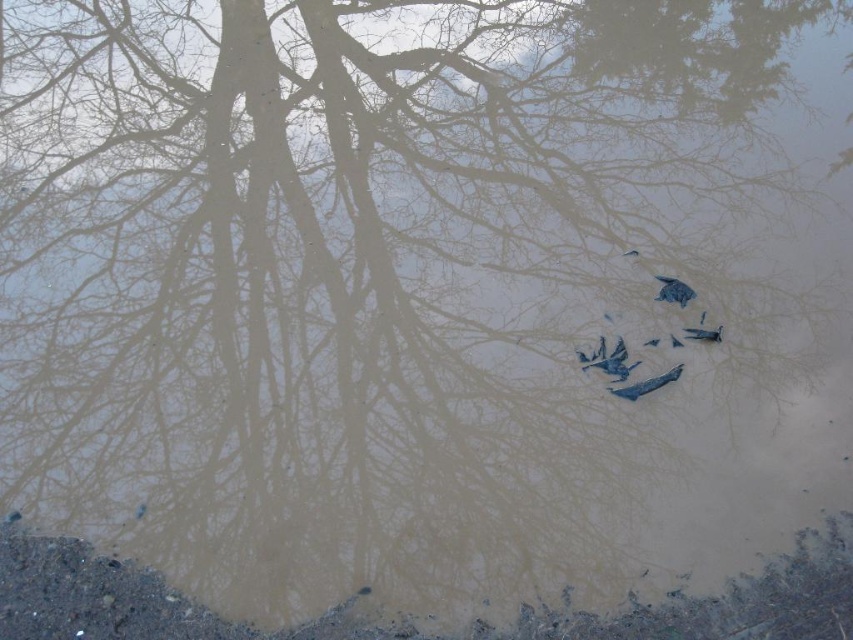
You are a photographer trying to capture both the blue paper at center and the shiny silver bird at upper center in the same frame. Given that your camera has a maximum focus range of 25 inches, will you be able to capture both objects clearly in focus?

The blue paper at center and the shiny silver bird at upper center are 26.25 inches apart. Since the distance between them exceeds the camera maximum focus range of 25 inches, you cannot capture both objects clearly in focus.

You are standing at the edge of the reflective surface and want to walk towards the point labeled as point (664, 284). However, there is an obstacle at point (44, 596). Will you encounter the obstacle before reaching your destination?

Point (44, 596) is in front of point (664, 284), so yes, you will encounter the obstacle at point (44, 596) before reaching your destination point (664, 284).

You are standing at the point labeled point (701, 333). You want to throw a stone to hit the reflection of the tree branches. Considering the water is 4.09 meters away from you, will the stone land in the water?

The distance between you and the water is 4.09 meters. Since the stone needs to travel that distance to reach the water, yes, the stone will land in the water if thrown accurately.